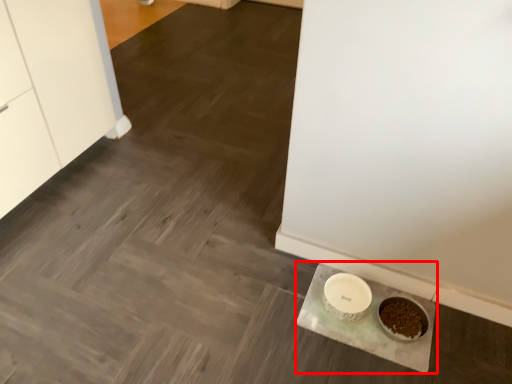
Question: From the image's perspective, where is slate (annotated by the red box) located relative to bowl?

Choices:
 (A) below
 (B) above

Answer: (A)